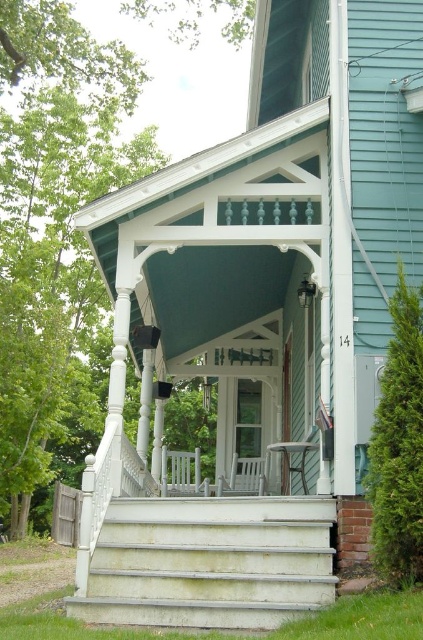
You are a delivery person trying to bring a large package up the gray concrete stairs at center to the white wood rocking chair at center. Considering their sizes, can you fit the package between them?

The gray concrete stairs at center is larger than the white wood rocking chair at center. Since the stairs are larger, there may not be enough space between them to fit the package. You might need to check the exact dimensions or consider an alternative path.

You are standing at the bottom of the gray concrete stairs at center and want to reach the white wood rocking chair at center. Which direction should you move to get there?

The gray concrete stairs at center is in front of the white wood rocking chair at center, so you should move forward to reach it.

Looking at this image, you are a delivery person carrying a package that needs to be placed on the porch. You are currently standing at the bottom of the gray concrete stairs at center. The white wood rocking chair at center is in your way. Can you walk around it to reach the porch without moving the chair?

The distance between the gray concrete stairs at center and the white wood rocking chair at center is 5.23 meters. Since the chair is 5.23 meters away from the stairs, you have enough space to walk around it without moving the chair.